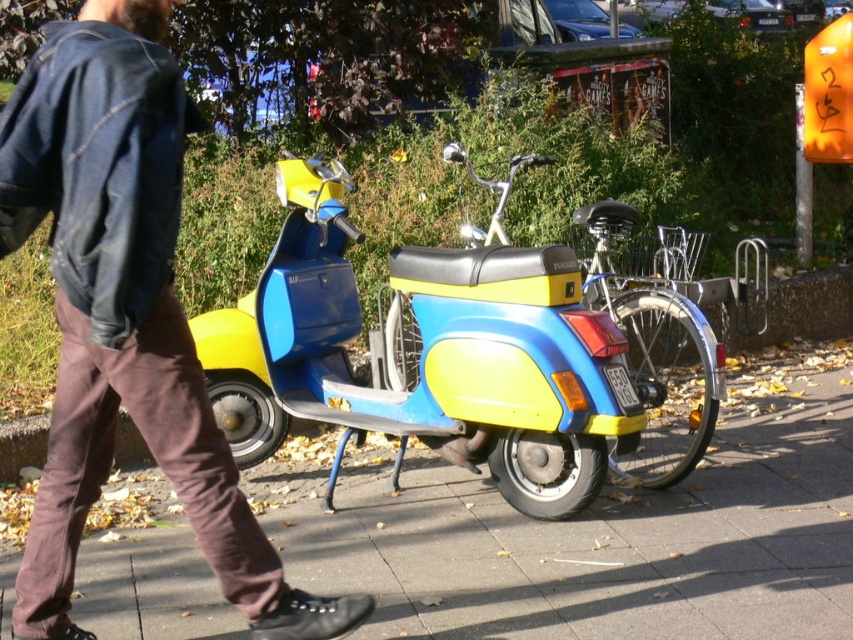
Is denim jacket at left to the right of yellow matte scooter at center from the viewer's perspective?

Incorrect, denim jacket at left is not on the right side of yellow matte scooter at center.

Who is shorter, denim jacket at left or yellow matte scooter at center?

Standing shorter between the two is yellow matte scooter at center.

You are a GUI agent. You are given a task and a screenshot of the screen. Output one action in this format:
    pyautogui.click(x=<x>, y=<y>)
    Task: Click on the denim jacket at left
    This screenshot has width=853, height=640.
    Given the screenshot: What is the action you would take?
    pyautogui.click(x=125, y=316)

This screenshot has width=853, height=640. What do you see at coordinates (601, 532) in the screenshot? I see `smooth concrete pavement at center` at bounding box center [601, 532].

Can you confirm if smooth concrete pavement at center is wider than denim jacket at left?

Yes, smooth concrete pavement at center is wider than denim jacket at left.

Does point (640, 528) come farther from viewer compared to point (4, 248)?

Yes, point (640, 528) is behind point (4, 248).

Find the location of a particular element. This screenshot has height=640, width=853. smooth concrete pavement at center is located at coordinates (601, 532).

Consider the image. Does smooth concrete pavement at center have a larger size compared to yellow matte scooter at center?

Indeed, smooth concrete pavement at center has a larger size compared to yellow matte scooter at center.

Is point (676, 570) farther from camera compared to point (577, 452)?

No, (676, 570) is in front of (577, 452).

I want to click on smooth concrete pavement at center, so click(601, 532).